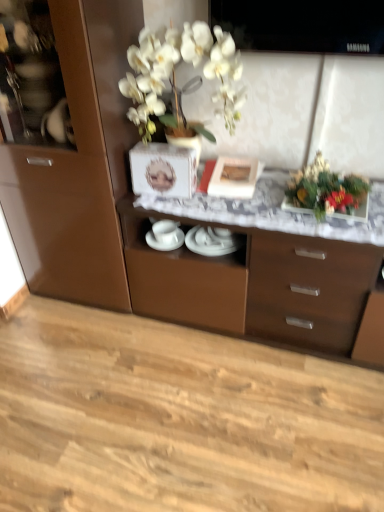
The image size is (384, 512). I want to click on free spot in front of matte white picture frame at center, so click(233, 207).